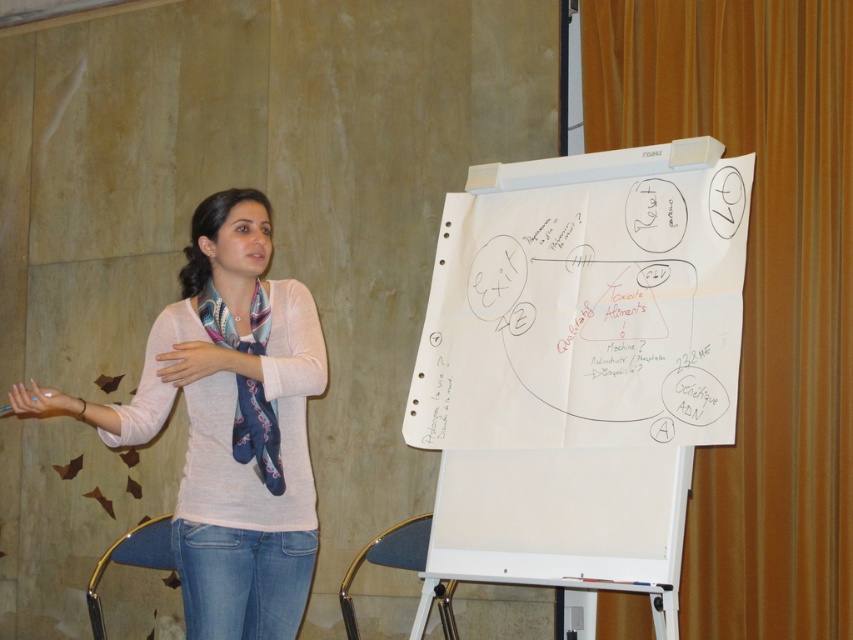
You are an attendee at a workshop and want to take a photo of the white paperboard at center and the silky blue scarf at left. Which object should you focus on first to ensure both are in the frame without moving the camera?

You should focus on the white paperboard at center first because it is larger in size than the silky blue scarf at left, so it will occupy more space in the frame and ensure both are visible without needing to adjust the camera position.

Based on the photo, you are a fashion designer observing a presentation. You notice the woman is wearing a light pink sweater at center and a silky blue scarf at left. How far apart are these two items on her outfit?

The light pink sweater at center and silky blue scarf at left are 4.11 inches apart.

You are an attendee at a safety training session. You need to take notes on the flip chart. Which object is larger in size between the white paperboard at center and the light pink sweater at center?

The white paperboard at center is bigger than the light pink sweater at center, so you should focus on writing on the white paperboard at center as it provides more space for notes.